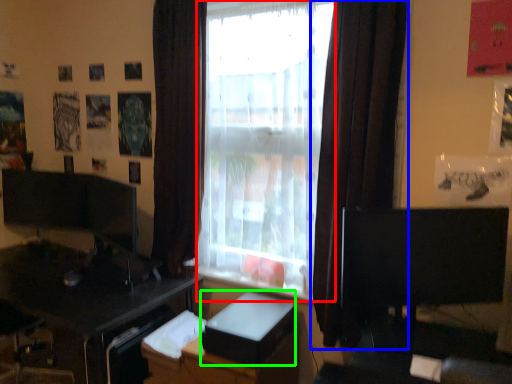
Question: Estimate the real-world distances between objects in this image. Which object is farther from window frame (highlighted by a red box), curtain (highlighted by a blue box) or cardboard box (highlighted by a green box)?

Choices:
 (A) curtain
 (B) cardboard box

Answer: (B)